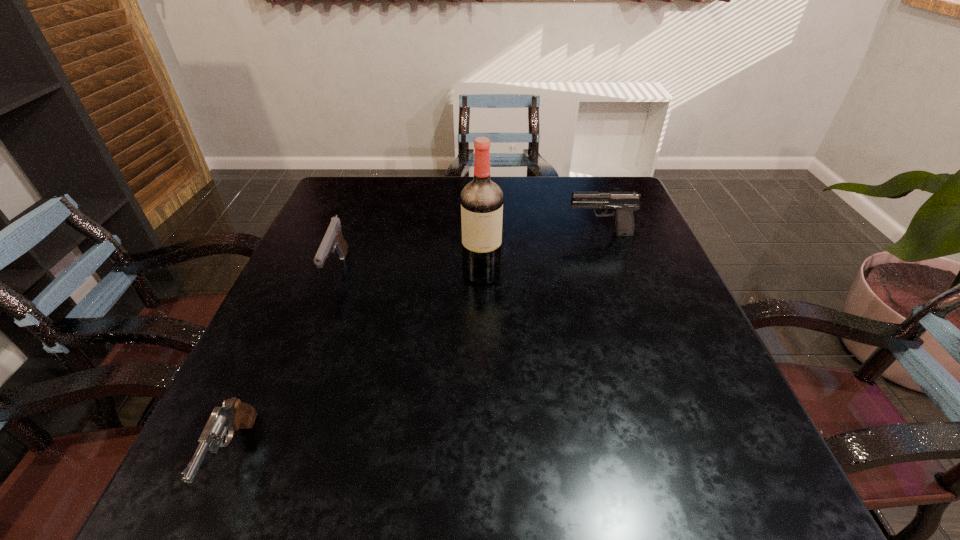
Identify the location of the third object from left to right. (481, 199).

You are a GUI agent. You are given a task and a screenshot of the screen. Output one action in this format:
    pyautogui.click(x=<x>, y=<y>)
    Task: Click on the liquor
    The height and width of the screenshot is (540, 960).
    Given the screenshot: What is the action you would take?
    pyautogui.click(x=481, y=199)

Locate an element on the screen. This screenshot has width=960, height=540. the farthest object is located at coordinates (624, 203).

Where is `the rightmost pistol`? This screenshot has width=960, height=540. the rightmost pistol is located at coordinates (624, 203).

Locate an element on the screen. the second nearest pistol is located at coordinates (333, 237).

Identify the location of the second pistol from right to left. (333, 237).

Where is `the leftmost pistol`? Image resolution: width=960 pixels, height=540 pixels. the leftmost pistol is located at coordinates (233, 415).

Image resolution: width=960 pixels, height=540 pixels. Identify the location of the leftmost object. (233, 415).

You are a GUI agent. You are given a task and a screenshot of the screen. Output one action in this format:
    pyautogui.click(x=<x>, y=<y>)
    Task: Click on the vacant position located on the front-facing side of the second object from right to left
    
    Given the screenshot: What is the action you would take?
    pyautogui.click(x=482, y=337)

At what (x,y) coordinates should I click in order to perform the action: click on vacant area situated aim along the barrel of the rightmost object. Please return your answer as a coordinate pair (x, y). Looking at the image, I should click on (485, 234).